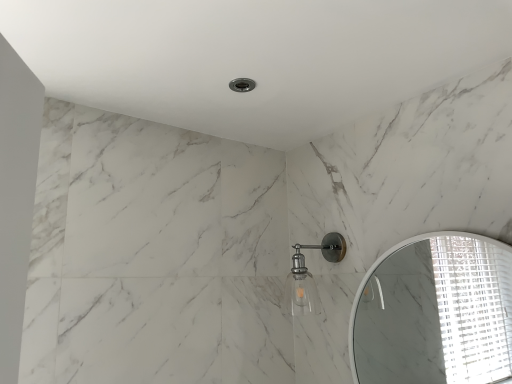
Question: Relative to satin nickel fixture at upper center, is white glossy mirror at upper right in front or behind?

Choices:
 (A) front
 (B) behind

Answer: (A)

Question: Considering the positions of point (439, 316) and point (287, 297), is point (439, 316) closer or farther from the camera than point (287, 297)?

Choices:
 (A) farther
 (B) closer

Answer: (A)

Question: From the image's perspective, is white glossy mirror at upper right located above or below satin nickel fixture at upper center?

Choices:
 (A) below
 (B) above

Answer: (A)

Question: Based on their sizes in the image, would you say satin nickel fixture at upper center is bigger or smaller than white glossy mirror at upper right?

Choices:
 (A) big
 (B) small

Answer: (B)

Question: In terms of height, does satin nickel fixture at upper center look taller or shorter compared to white glossy mirror at upper right?

Choices:
 (A) short
 (B) tall

Answer: (A)

Question: From the image's perspective, is satin nickel fixture at upper center located above or below white glossy mirror at upper right?

Choices:
 (A) below
 (B) above

Answer: (B)

Question: Considering the positions of satin nickel fixture at upper center and white glossy mirror at upper right in the image, is satin nickel fixture at upper center wider or thinner than white glossy mirror at upper right?

Choices:
 (A) wide
 (B) thin

Answer: (A)